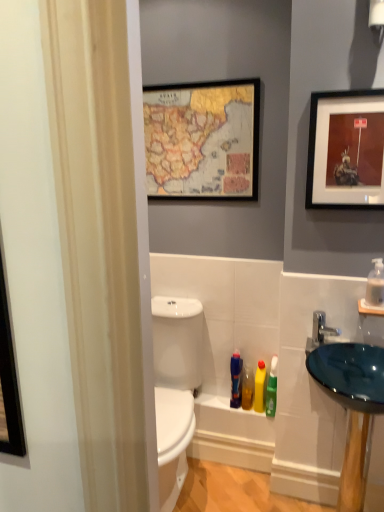
Question: In the image, is wooden-framed map at upper center, placed as the 2th picture frame when sorted from front to back, positioned in front of or behind translucent plastic soap dispenser at right?

Choices:
 (A) behind
 (B) front

Answer: (A)

Question: Is wooden-framed map at upper center, which is the 1th picture frame from back to front, to the left or to the right of translucent plastic soap dispenser at right in the image?

Choices:
 (A) right
 (B) left

Answer: (B)

Question: Which object is positioned closest to the translucent plastic bottle at lower center, marked as the 3th toiletry in a right-to-left arrangement?

Choices:
 (A) translucent plastic soap dispenser at right
 (B) wooden-framed map at upper center, positioned as the 1th picture frame in left-to-right order
 (C) blue glass sink at right
 (D) teal glass sink at right
 (E) silver metallic faucet at right

Answer: (D)

Question: Considering the real-world distances, which object is farthest from the wooden framed picture at upper right, placed as the first picture frame when sorted from front to back?

Choices:
 (A) silver metallic faucet at right
 (B) translucent green bottle at lower center, the 4th toiletry when ordered from left to right
 (C) teal glass sink at right
 (D) wooden-framed map at upper center, the second picture frame in the right-to-left sequence
 (E) translucent plastic soap dispenser at right

Answer: (B)